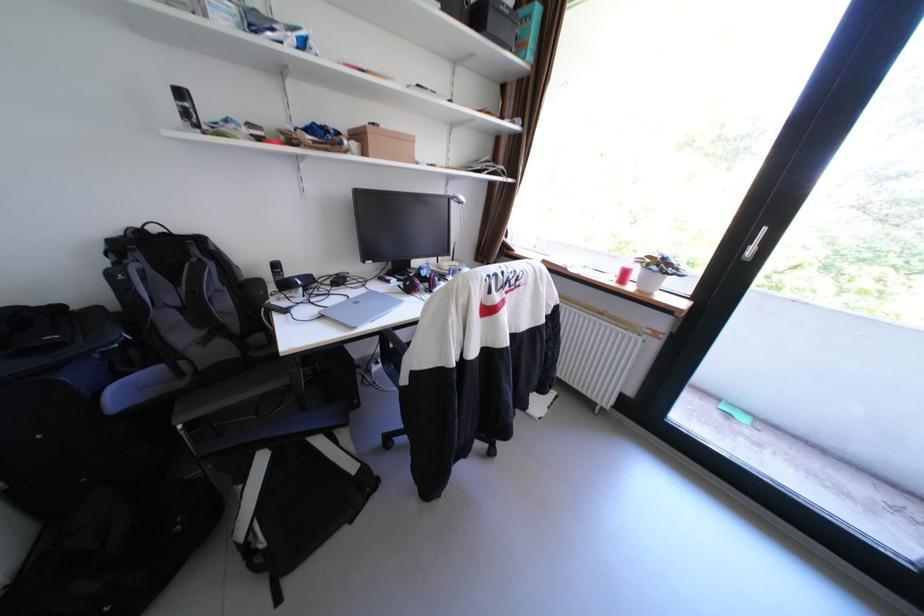
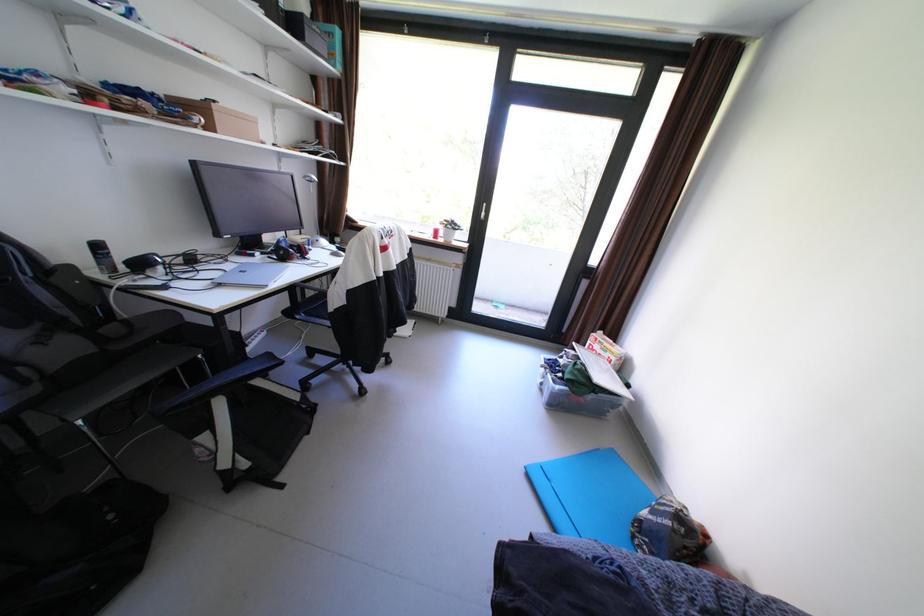
Question: I am providing you with two images of the same scene from different viewpoints. After the viewpoint changes to image2, which objects are now occluded?

Choices:
 (A) red headphones
 (B) brown cardboard box
 (C) silver door handle
 (D) none of these

Answer: (D)